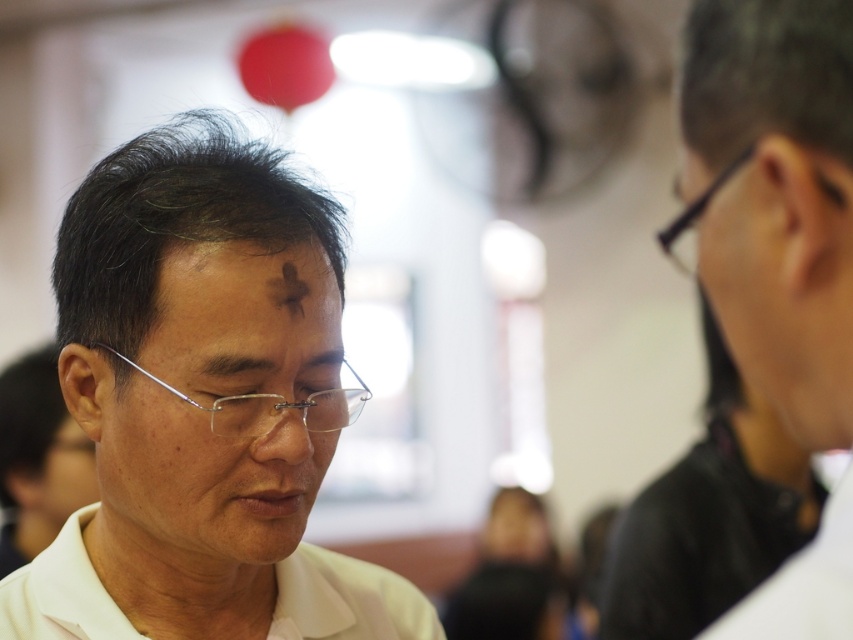
Question: Which point appears farthest from the camera in this image?

Choices:
 (A) (283, 259)
 (B) (335, 627)

Answer: (B)

Question: Is white matte shirt at center positioned behind black plastic glasses at upper right?

Choices:
 (A) no
 (B) yes

Answer: (B)

Question: Does matte black shirt at right have a larger size compared to brown matte forehead at center?

Choices:
 (A) no
 (B) yes

Answer: (B)

Question: Which is nearer to the white matte shirt at center?

Choices:
 (A) brown matte forehead at center
 (B) white matte dress shirt at lower left
 (C) clear plastic glasses at center
 (D) black plastic glasses at upper right

Answer: (A)

Question: Is the position of matte black shirt at right more distant than that of clear plastic glasses at center?

Choices:
 (A) no
 (B) yes

Answer: (A)

Question: Which point appears closest to the camera in this image?

Choices:
 (A) (668, 224)
 (B) (310, 547)
 (C) (166, 317)
 (D) (337, 336)

Answer: (C)